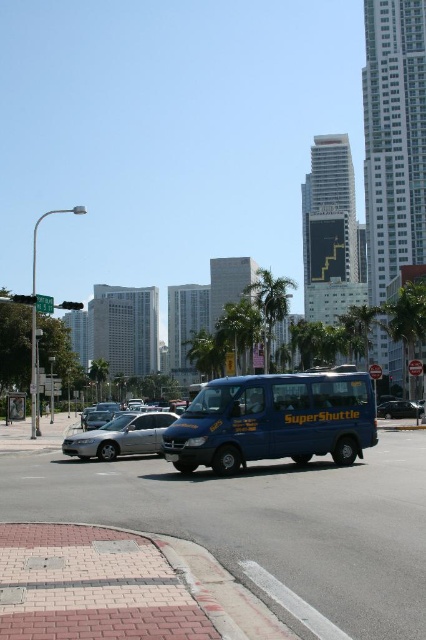
This screenshot has width=426, height=640. Identify the location of silver metallic sedan at center. (120, 436).

Between silver metallic sedan at center and green leafy palm tree at center, which one is positioned lower?

silver metallic sedan at center is below.

Is point (95, 436) positioned before point (275, 307)?

Yes, it is.

Where is `silver metallic sedan at center`? silver metallic sedan at center is located at coordinates (120, 436).

Is blue matte van at center taller than green leafy palm tree at center?

No, blue matte van at center is not taller than green leafy palm tree at center.

Who is more forward, (304,406) or (253,301)?

Point (304,406) is more forward.

Identify the location of blue matte van at center. (275, 420).

Does blue matte van at center appear over metallic blue van at center?

Yes, blue matte van at center is above metallic blue van at center.

Can you confirm if blue matte van at center is thinner than metallic blue van at center?

Yes.

Find the location of `blue matte van at center`. blue matte van at center is located at coordinates (275, 420).